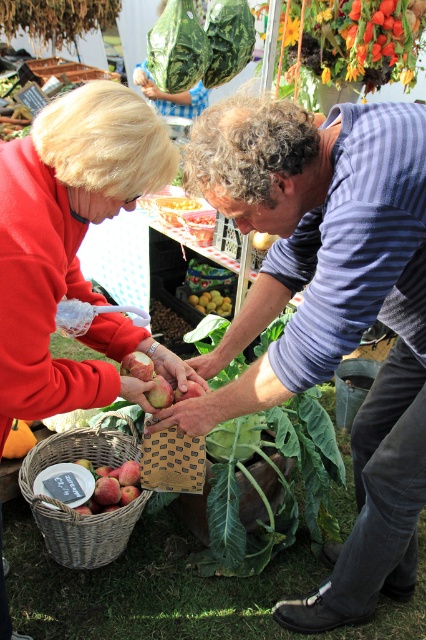
Between woven brown basket at lower left and green leafy vegetable at upper center, which one has more height?

Standing taller between the two is woven brown basket at lower left.

Is point (60, 552) in front of point (181, 38)?

Yes, it is.

Find the location of a particular element. Image resolution: width=426 pixels, height=640 pixels. woven brown basket at lower left is located at coordinates (74, 509).

Is green leafy vegetable at upper center smaller than yellow matte pears at center?

Incorrect, green leafy vegetable at upper center is not smaller in size than yellow matte pears at center.

Image resolution: width=426 pixels, height=640 pixels. Identify the location of green leafy vegetable at upper center. tap(178, 48).

From the picture: Is green leafy vegetable at upper center bigger than red matte apple at lower left?

Yes, green leafy vegetable at upper center is bigger than red matte apple at lower left.

Is green leafy vegetable at upper center thinner than red matte apple at lower left?

In fact, green leafy vegetable at upper center might be wider than red matte apple at lower left.

Between point (189, 1) and point (92, 504), which one is positioned behind?

The point (189, 1) is more distant.

Where is `green leafy vegetable at upper center`? This screenshot has width=426, height=640. green leafy vegetable at upper center is located at coordinates (178, 48).